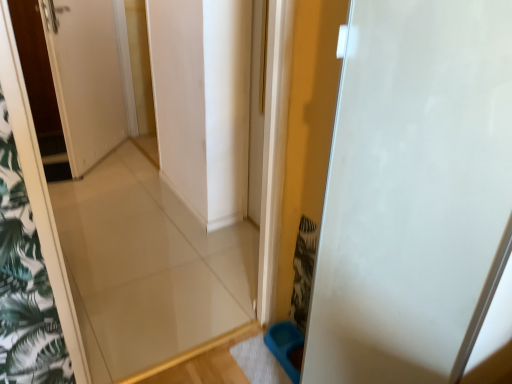
How much space does white glossy door at upper left, which is counted as the 2th door, starting from the right, occupy vertically?

1.21 meters.

Locate an element on the screen. white glossy door at upper left, the first door positioned from the back is located at coordinates (90, 76).

Describe the element at coordinates (90, 76) in the screenshot. I see `white glossy door at upper left, positioned as the first door in top-to-bottom order` at that location.

Measure the distance between white matte door at right, which ranks as the 1th door in bottom-to-top order, and camera.

The depth of white matte door at right, which ranks as the 1th door in bottom-to-top order, is 21.54 inches.

This screenshot has height=384, width=512. Describe the element at coordinates (413, 192) in the screenshot. I see `white matte door at right, which ranks as the 1th door in bottom-to-top order` at that location.

Identify the location of white matte door at right, the 2th door in the back-to-front sequence. (413, 192).

Locate an element on the screen. This screenshot has width=512, height=384. white glossy door at upper left, which is the 2th door from bottom to top is located at coordinates (90, 76).

Can you confirm if white glossy door at upper left, which is counted as the 2th door, starting from the right, is positioned to the left of white matte door at right, arranged as the 2th door when viewed from the top?

Correct, you'll find white glossy door at upper left, which is counted as the 2th door, starting from the right, to the left of white matte door at right, arranged as the 2th door when viewed from the top.

Looking at this image, is the position of white glossy door at upper left, which is the 2th door from bottom to top, more distant than that of white matte door at right, which ranks as the 1th door in bottom-to-top order?

Yes, white glossy door at upper left, which is the 2th door from bottom to top, is further from the camera.

Which is in front, point (77, 98) or point (411, 110)?

The point (411, 110) is more forward.

From the image's perspective, relative to white matte door at right, which is counted as the second door, starting from the left, is white glossy door at upper left, which is the 2th door from bottom to top, above or below?

Based on their image positions, white glossy door at upper left, which is the 2th door from bottom to top, is located above white matte door at right, which is counted as the second door, starting from the left.

From a real-world perspective, is white glossy door at upper left, the first door positioned from the back, beneath white matte door at right, which ranks as the 1th door in bottom-to-top order?

Yes, from a real-world perspective, white glossy door at upper left, the first door positioned from the back, is beneath white matte door at right, which ranks as the 1th door in bottom-to-top order.

Looking at this image, which object is wider, white glossy door at upper left, the first door positioned from the back, or white matte door at right, arranged as the 2th door when viewed from the top?

Wider between the two is white matte door at right, arranged as the 2th door when viewed from the top.

Considering the sizes of white glossy door at upper left, positioned as the second door in front-to-back order, and white matte door at right, the 2th door in the back-to-front sequence, in the image, is white glossy door at upper left, positioned as the second door in front-to-back order, taller or shorter than white matte door at right, the 2th door in the back-to-front sequence,?

In the image, white glossy door at upper left, positioned as the second door in front-to-back order, appears to be shorter than white matte door at right, the 2th door in the back-to-front sequence.

In terms of size, does white glossy door at upper left, positioned as the second door in front-to-back order, appear bigger or smaller than white matte door at right, which is counted as the second door, starting from the left?

Considering their sizes, white glossy door at upper left, positioned as the second door in front-to-back order, takes up less space than white matte door at right, which is counted as the second door, starting from the left.

Is white matte door at right, marked as the first door in a front-to-back arrangement, surrounded by white glossy door at upper left, which is counted as the 2th door, starting from the right?

That's incorrect, white matte door at right, marked as the first door in a front-to-back arrangement, is not inside white glossy door at upper left, which is counted as the 2th door, starting from the right.

Is white glossy door at upper left, acting as the first door starting from the left, not close to white matte door at right, which ranks as the 1th door in bottom-to-top order?

Indeed, white glossy door at upper left, acting as the first door starting from the left, is not near white matte door at right, which ranks as the 1th door in bottom-to-top order.

Could you tell me if white glossy door at upper left, which is the 2th door from bottom to top, is turned towards white matte door at right, marked as the first door in a front-to-back arrangement?

No.

What's the angular difference between white glossy door at upper left, the first door positioned from the back, and white matte door at right, which ranks as the 1th door in bottom-to-top order,'s facing directions?

They differ by 41.7 degrees in their facing directions.

Could you measure the distance between white glossy door at upper left, which is counted as the 2th door, starting from the right, and white matte door at right, which ranks as the 1th door in bottom-to-top order?

The distance of white glossy door at upper left, which is counted as the 2th door, starting from the right, from white matte door at right, which ranks as the 1th door in bottom-to-top order, is 2.51 meters.

Find the location of a particular element. door in front of the white glossy door at upper left, the first door positioned from the back is located at coordinates (413, 192).

Based on the photo, based on their positions, is white matte door at right, which is counted as the second door, starting from the left, located to the left or right of white glossy door at upper left, acting as the first door starting from the left?

Based on their positions, white matte door at right, which is counted as the second door, starting from the left, is located to the right of white glossy door at upper left, acting as the first door starting from the left.

Who is more distant, white matte door at right, arranged as the 2th door when viewed from the top, or white glossy door at upper left, the first door positioned from the back?

white glossy door at upper left, the first door positioned from the back, is behind.

Which point is more distant from viewer, [409,164] or [49,36]?

The point [49,36] is behind.

From the image's perspective, between white matte door at right, the 2th door in the back-to-front sequence, and white glossy door at upper left, which is the 2th door from bottom to top, which one is located above?

From the image's view, white glossy door at upper left, which is the 2th door from bottom to top, is above.

From a real-world perspective, is white matte door at right, the 2th door in the back-to-front sequence, under white glossy door at upper left, which is the 2th door from bottom to top?

Incorrect, from a real-world perspective, white matte door at right, the 2th door in the back-to-front sequence, is higher than white glossy door at upper left, which is the 2th door from bottom to top.

Does white matte door at right, arranged as the 2th door when viewed from the top, have a greater width compared to white glossy door at upper left, the first door positioned from the back?

Correct, the width of white matte door at right, arranged as the 2th door when viewed from the top, exceeds that of white glossy door at upper left, the first door positioned from the back.

Can you confirm if white matte door at right, which ranks as the 1th door in bottom-to-top order, is shorter than white glossy door at upper left, which is counted as the 2th door, starting from the right?

Incorrect, the height of white matte door at right, which ranks as the 1th door in bottom-to-top order, does not fall short of that of white glossy door at upper left, which is counted as the 2th door, starting from the right.

Looking at this image, in terms of size, does white matte door at right, which is counted as the second door, starting from the left, appear bigger or smaller than white glossy door at upper left, positioned as the second door in front-to-back order?

Clearly, white matte door at right, which is counted as the second door, starting from the left, is larger in size than white glossy door at upper left, positioned as the second door in front-to-back order.

Would you say white matte door at right, which is counted as the second door, starting from the left, is outside white glossy door at upper left, acting as the first door starting from the left?

Yes.

Are white matte door at right, the 2th door in the back-to-front sequence, and white glossy door at upper left, positioned as the first door in top-to-bottom order, making contact?

They are not placed beside each other.

Does white matte door at right, which is counted as the second door, starting from the left, turn towards white glossy door at upper left, which is counted as the 2th door, starting from the right?

No, white matte door at right, which is counted as the second door, starting from the left, is not oriented towards white glossy door at upper left, which is counted as the 2th door, starting from the right.

How different are the orientations of white matte door at right, arranged as the 2th door when viewed from the top, and white glossy door at upper left, positioned as the second door in front-to-back order, in degrees?

41.7 degrees.

Looking at this image, how distant is white matte door at right, which ranks as the 1th door in bottom-to-top order, from white glossy door at upper left, positioned as the second door in front-to-back order?

A distance of 2.51 meters exists between white matte door at right, which ranks as the 1th door in bottom-to-top order, and white glossy door at upper left, positioned as the second door in front-to-back order.

Locate an element on the screen. door lying above the white matte door at right, which ranks as the 1th door in bottom-to-top order (from the image's perspective) is located at coordinates (90, 76).

Where is `door below the white glossy door at upper left, which is the 2th door from bottom to top (from the image's perspective)`? door below the white glossy door at upper left, which is the 2th door from bottom to top (from the image's perspective) is located at coordinates (413, 192).

What are the coordinates of `door above the white matte door at right, arranged as the 2th door when viewed from the top (from the image's perspective)` in the screenshot? It's located at (90, 76).